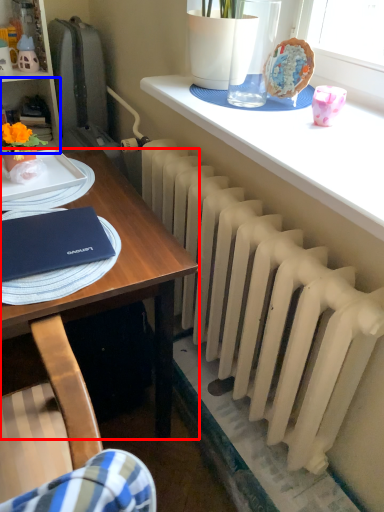
Question: Which point is further to the camera, desk (highlighted by a red box) or shelf (highlighted by a blue box)?

Choices:
 (A) desk
 (B) shelf

Answer: (B)